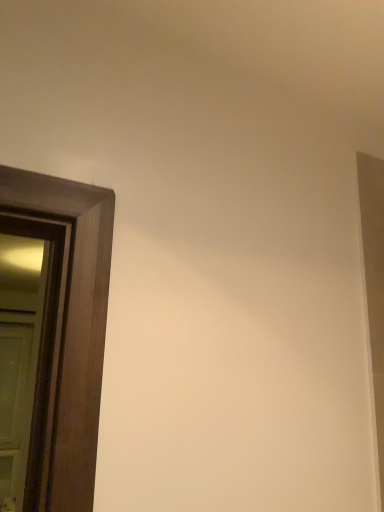
What do you see at coordinates (15, 411) in the screenshot? I see `wooden door at left` at bounding box center [15, 411].

At what (x,y) coordinates should I click in order to perform the action: click on wooden door at left. Please return your answer as a coordinate pair (x, y). The image size is (384, 512). Looking at the image, I should click on (15, 411).

Where is `wooden door at left`? wooden door at left is located at coordinates (15, 411).